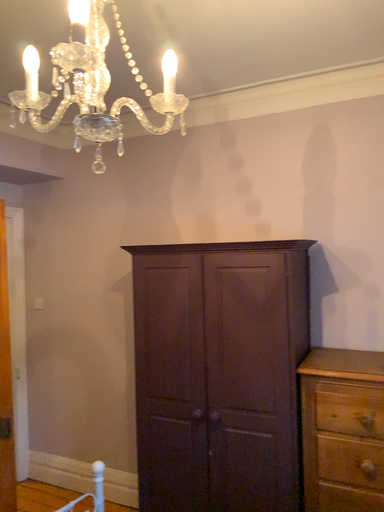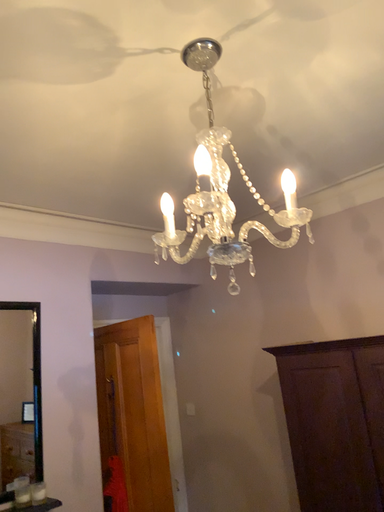
Question: Which way did the camera rotate in the video?

Choices:
 (A) rotated downward
 (B) rotated upward

Answer: (B)